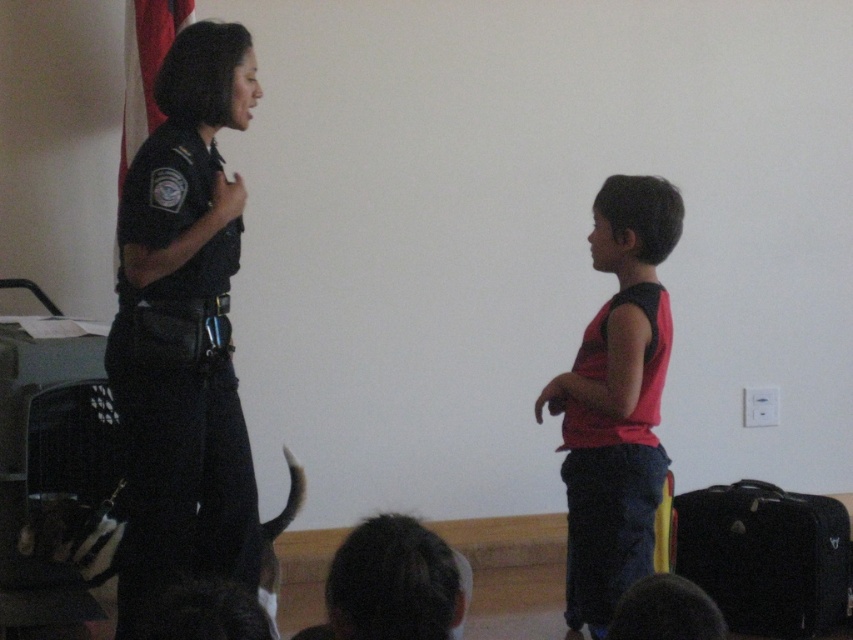
Question: Considering the relative positions of dark blue uniform at left and black fabric suitcase at lower right in the image provided, where is dark blue uniform at left located with respect to black fabric suitcase at lower right?

Choices:
 (A) above
 (B) below

Answer: (A)

Question: Considering the real-world distances, which object is farthest from the dark blue uniform at left?

Choices:
 (A) black fabric suitcase at lower right
 (B) red matte tank top at right

Answer: (A)

Question: Among these points, which one is farthest from the camera?

Choices:
 (A) (616, 451)
 (B) (788, 636)

Answer: (B)

Question: Is dark blue uniform at left below black fabric suitcase at lower right?

Choices:
 (A) yes
 (B) no

Answer: (B)

Question: Does dark blue uniform at left have a smaller size compared to black fabric suitcase at lower right?

Choices:
 (A) yes
 (B) no

Answer: (B)

Question: Based on their relative distances, which object is nearer to the dark blue uniform at left?

Choices:
 (A) red matte tank top at right
 (B) black fabric suitcase at lower right

Answer: (A)